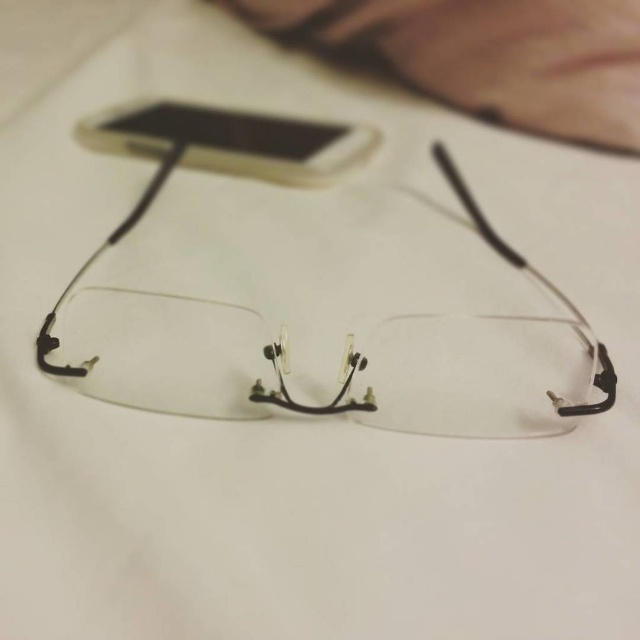
You need to place a small sticker on the clear plastic glasses at center without covering the lenses. Since the white plastic phone at upper center is in the way, can you move the glasses upwards to make space?

The clear plastic glasses at center is below the white plastic phone at upper center, so moving the glasses upwards would bring them closer to the phone, potentially causing them to collide. You should move the glasses downwards instead to avoid the phone.

You are organizing items on a desk and need to place the clear plastic glasses at center and the white plastic phone at upper center. If you want to arrange them so that the smaller item is placed to the left, which item should be positioned where?

The white plastic phone at upper center is smaller than the clear plastic glasses at center. Therefore, the white plastic phone at upper center should be placed to the left since it is the smaller item.

From the picture: You are organizing items on a desk and see the clear plastic glasses at center and the white plastic phone at upper center. Which item is positioned more to the right side of the desk?

The clear plastic glasses at center is positioned more to the right side of the desk than the white plastic phone at upper center.